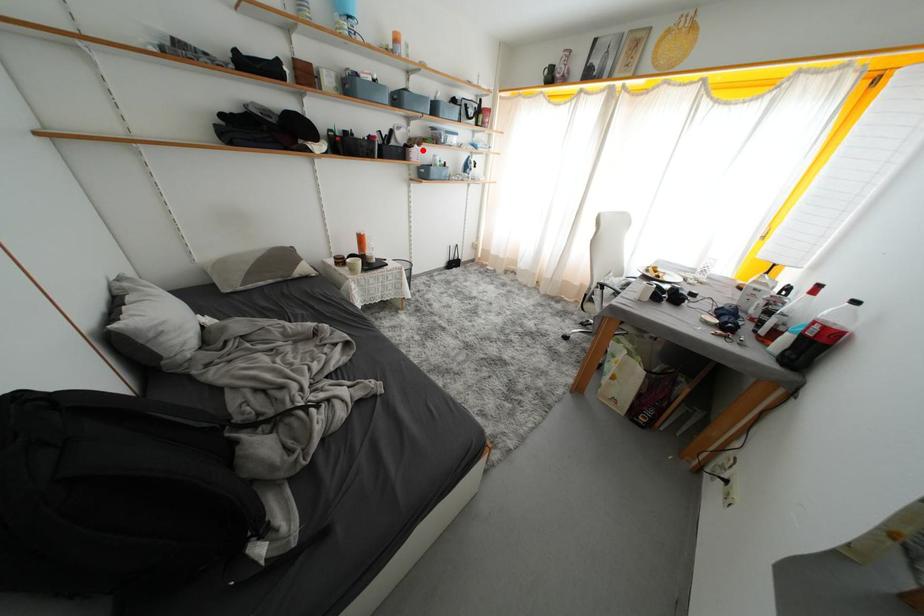
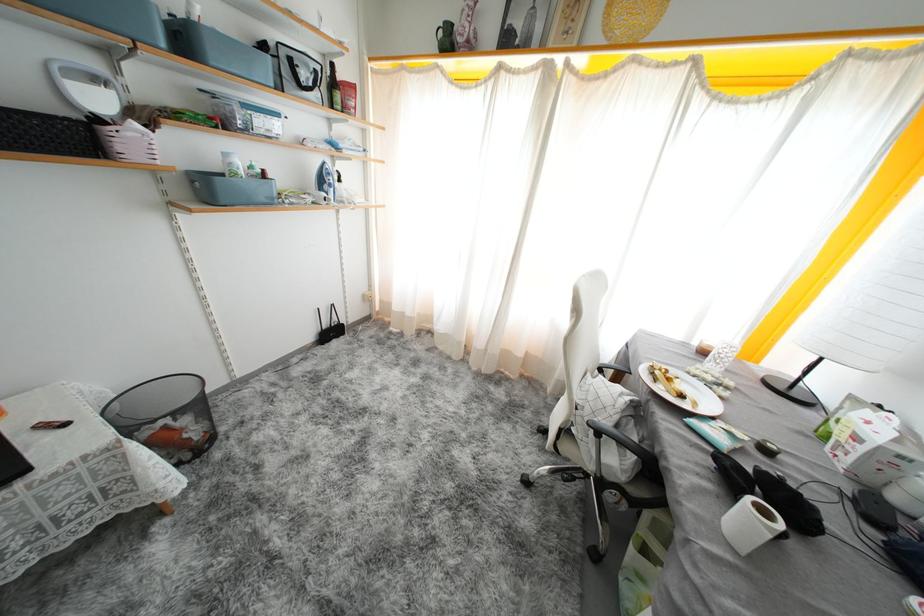
Find the pixel in the second image that matches the highlighted location in the first image.

(141, 129)